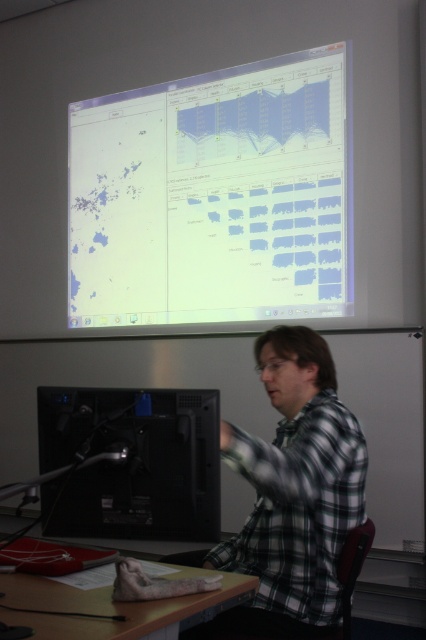
Question: Which point is farther from the camera taking this photo?

Choices:
 (A) (325, 442)
 (B) (175, 428)

Answer: (A)

Question: Is white glossy screen at upper center positioned in front of black matte computer at lower left?

Choices:
 (A) yes
 (B) no

Answer: (B)

Question: Considering the relative positions of white glossy screen at upper center and wooden desk at lower center in the image provided, where is white glossy screen at upper center located with respect to wooden desk at lower center?

Choices:
 (A) right
 (B) left

Answer: (A)

Question: Which point is farther to the camera?

Choices:
 (A) wooden desk at lower center
 (B) white glossy screen at upper center
 (C) plaid fabric shirt at lower right
 (D) black matte computer at lower left

Answer: (B)

Question: Does plaid fabric shirt at lower right come in front of wooden desk at lower center?

Choices:
 (A) no
 (B) yes

Answer: (A)

Question: Which point appears closest to the camera in this image?

Choices:
 (A) (132, 531)
 (B) (40, 596)
 (C) (307, 604)
 (D) (256, 208)

Answer: (B)